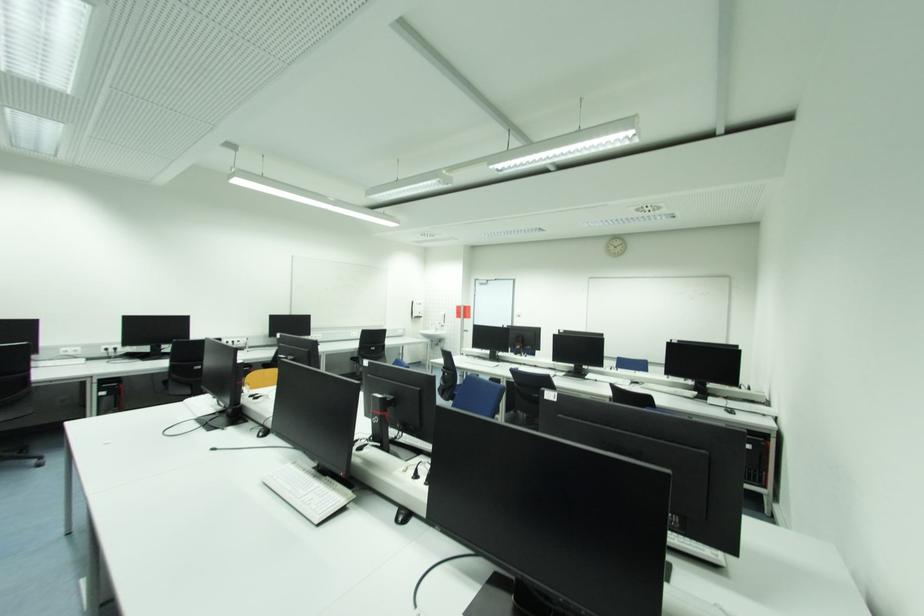
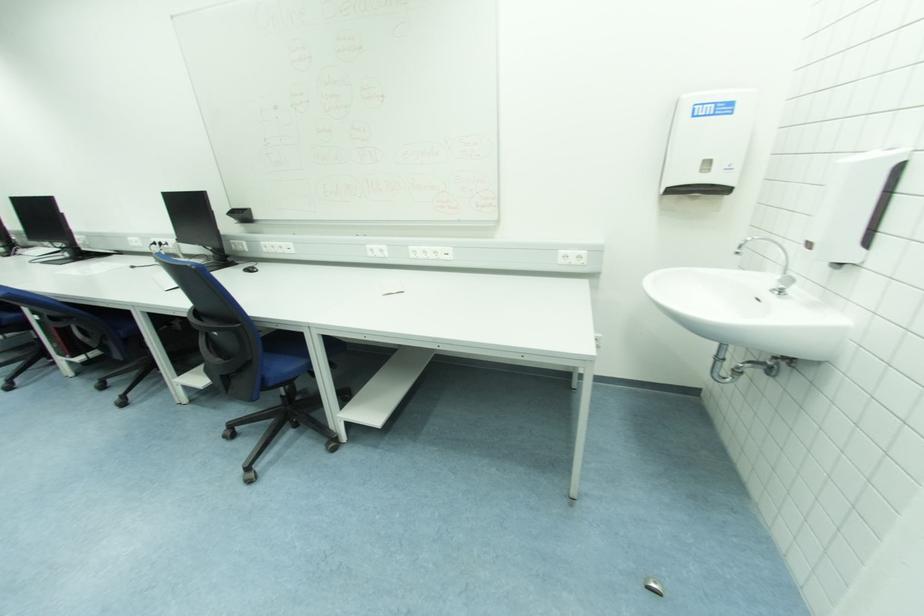
Where in the second image is the point corresponding to [423,305] from the first image?

(731, 110)